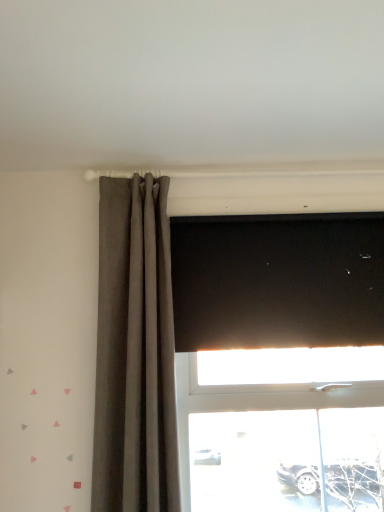
Question: Is black matte blind at upper center at the back of matte gray curtain at left?

Choices:
 (A) no
 (B) yes

Answer: (A)

Question: Is there a large distance between matte gray curtain at left and black matte blind at upper center?

Choices:
 (A) yes
 (B) no

Answer: (B)

Question: Is matte gray curtain at left smaller than black matte blind at upper center?

Choices:
 (A) no
 (B) yes

Answer: (A)

Question: Is matte gray curtain at left positioned beyond the bounds of black matte blind at upper center?

Choices:
 (A) yes
 (B) no

Answer: (A)

Question: Is black matte blind at upper center surrounded by matte gray curtain at left?

Choices:
 (A) yes
 (B) no

Answer: (B)

Question: Does matte gray curtain at left have a lesser width compared to black matte blind at upper center?

Choices:
 (A) no
 (B) yes

Answer: (A)

Question: From a real-world perspective, does black matte blind at upper center stand above matte gray curtain at left?

Choices:
 (A) no
 (B) yes

Answer: (B)

Question: Considering the relative sizes of black matte blind at upper center and matte gray curtain at left in the image provided, is black matte blind at upper center shorter than matte gray curtain at left?

Choices:
 (A) no
 (B) yes

Answer: (B)

Question: Is black matte blind at upper center looking in the opposite direction of matte gray curtain at left?

Choices:
 (A) no
 (B) yes

Answer: (A)

Question: Can you confirm if black matte blind at upper center is positioned to the left of matte gray curtain at left?

Choices:
 (A) yes
 (B) no

Answer: (B)

Question: Is black matte blind at upper center further to the viewer compared to matte gray curtain at left?

Choices:
 (A) yes
 (B) no

Answer: (A)

Question: Can you confirm if black matte blind at upper center is bigger than matte gray curtain at left?

Choices:
 (A) yes
 (B) no

Answer: (B)

Question: Is black matte blind at upper center to the left or to the right of matte gray curtain at left in the image?

Choices:
 (A) right
 (B) left

Answer: (A)